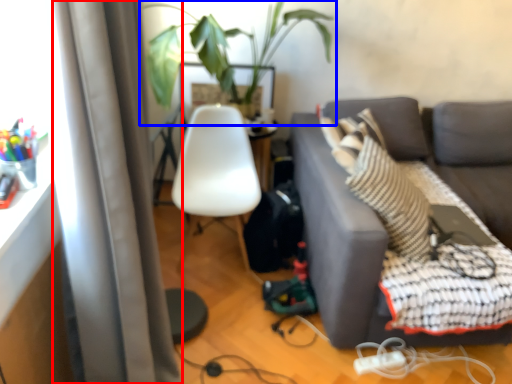
Question: Which point is further to the camera, curtain (highlighted by a red box) or houseplant (highlighted by a blue box)?

Choices:
 (A) curtain
 (B) houseplant

Answer: (B)